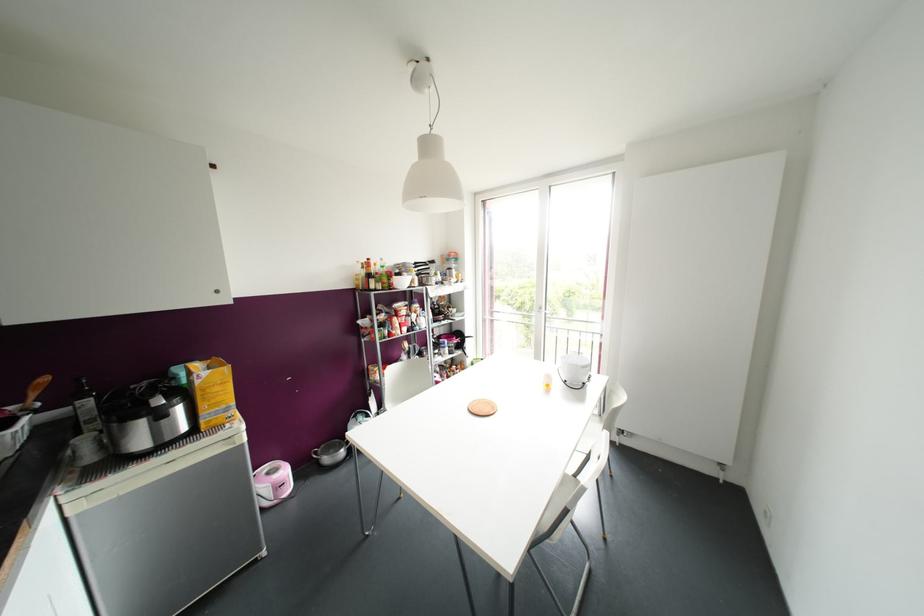
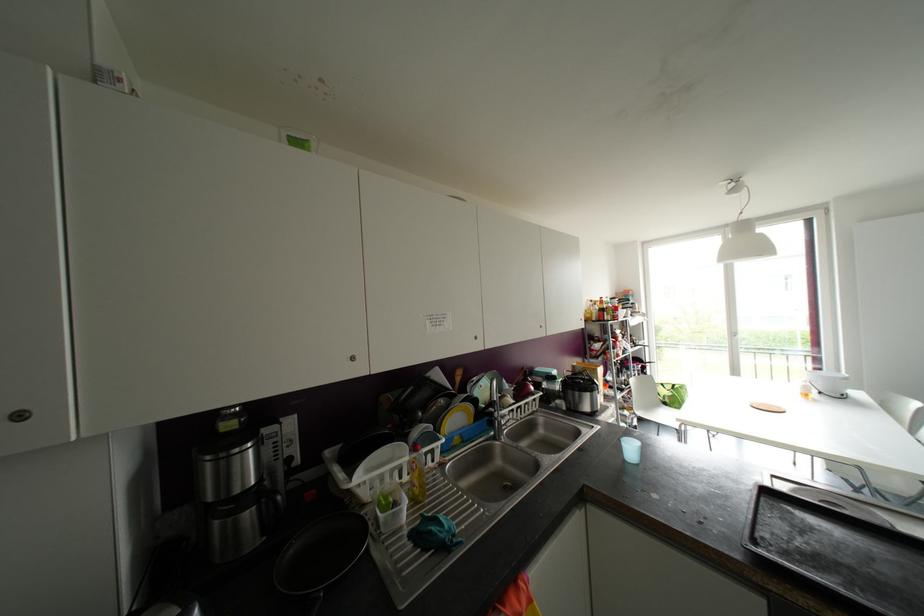
The images are taken continuously from a first-person perspective. In which direction are you moving?

The movement direction of the cameraman is left, backward.